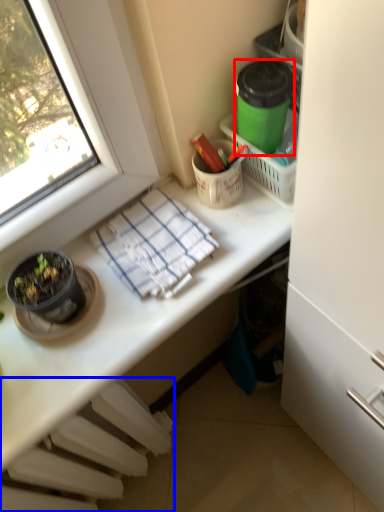
Question: Which point is further to the camera, appliance (highlighted by a red box) or radiator (highlighted by a blue box)?

Choices:
 (A) appliance
 (B) radiator

Answer: (B)